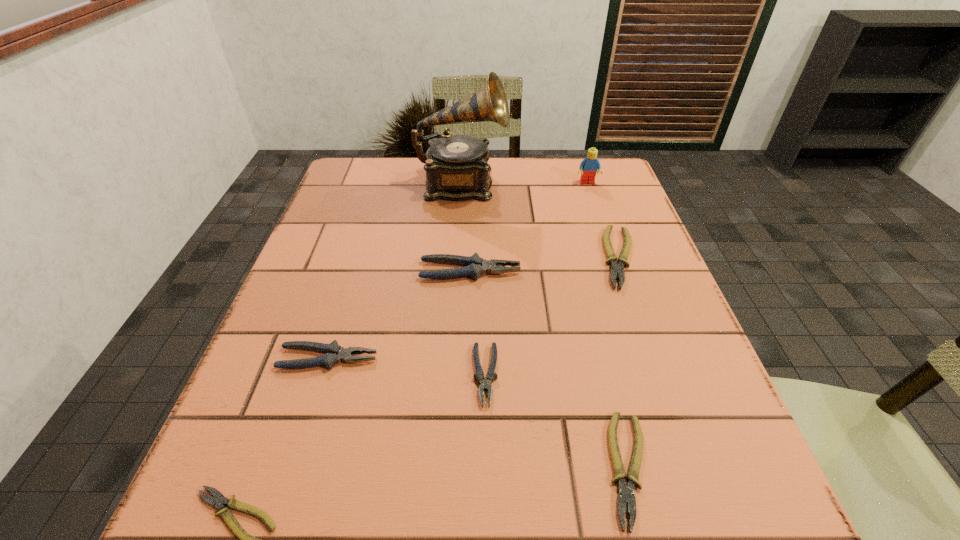
I want to click on object located in the near edge section of the desktop, so click(x=626, y=493).

Where is `object at the left edge`? object at the left edge is located at coordinates tap(334, 353).

Locate an element on the screen. Lego present at the right edge is located at coordinates (588, 167).

The image size is (960, 540). I want to click on object present at the far right corner, so click(x=588, y=167).

Where is `object positioned at the near right corner`? This screenshot has height=540, width=960. object positioned at the near right corner is located at coordinates (x=626, y=493).

You are a GUI agent. You are given a task and a screenshot of the screen. Output one action in this format:
    pyautogui.click(x=<x>, y=<y>)
    Task: Click on the vacant region at the near edge of the desktop
    This screenshot has height=540, width=960.
    Given the screenshot: What is the action you would take?
    pyautogui.click(x=429, y=522)

In the image, there is a desktop. In order to click on free space at the left edge in this screenshot , I will do `click(304, 286)`.

You are a GUI agent. You are given a task and a screenshot of the screen. Output one action in this format:
    pyautogui.click(x=<x>, y=<y>)
    Task: Click on the vacant space at the right edge of the desktop
    The width and height of the screenshot is (960, 540).
    Given the screenshot: What is the action you would take?
    pyautogui.click(x=645, y=227)

You are a GUI agent. You are given a task and a screenshot of the screen. Output one action in this format:
    pyautogui.click(x=<x>, y=<y>)
    Task: Click on the vacant space at the near left corner of the desktop
    Image resolution: width=960 pixels, height=540 pixels.
    Given the screenshot: What is the action you would take?
    pyautogui.click(x=299, y=487)

In the image, there is a desktop. Find the location of `blank space at the far right corner`. blank space at the far right corner is located at coordinates (559, 159).